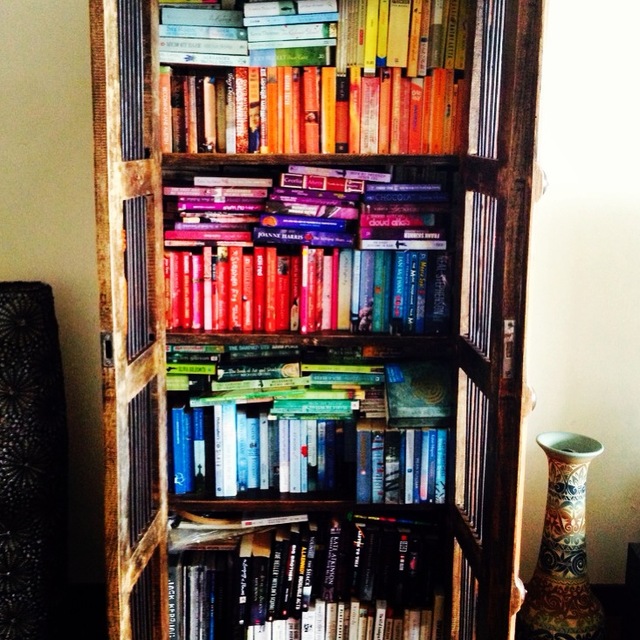
I want to click on vase, so click(575, 502).